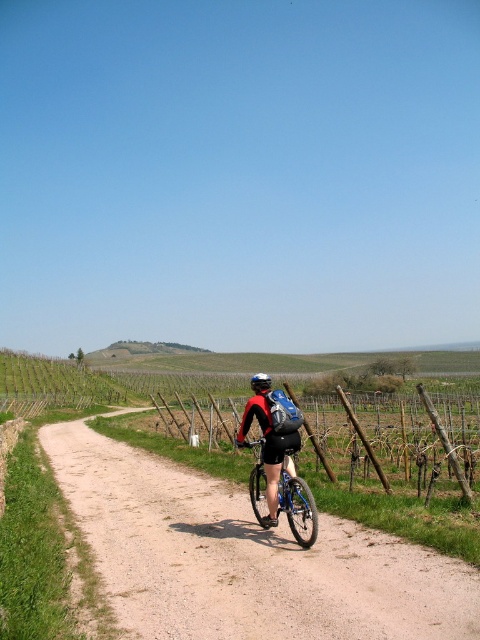
In order to click on dirt path at center in this screenshot , I will do `click(243, 557)`.

Does dirt path at center have a greater height compared to blue metallic bicycle at center?

Yes.

Is point (276, 547) positioned before point (315, 534)?

No, it is behind (315, 534).

The image size is (480, 640). Find the location of `dirt path at center`. dirt path at center is located at coordinates (243, 557).